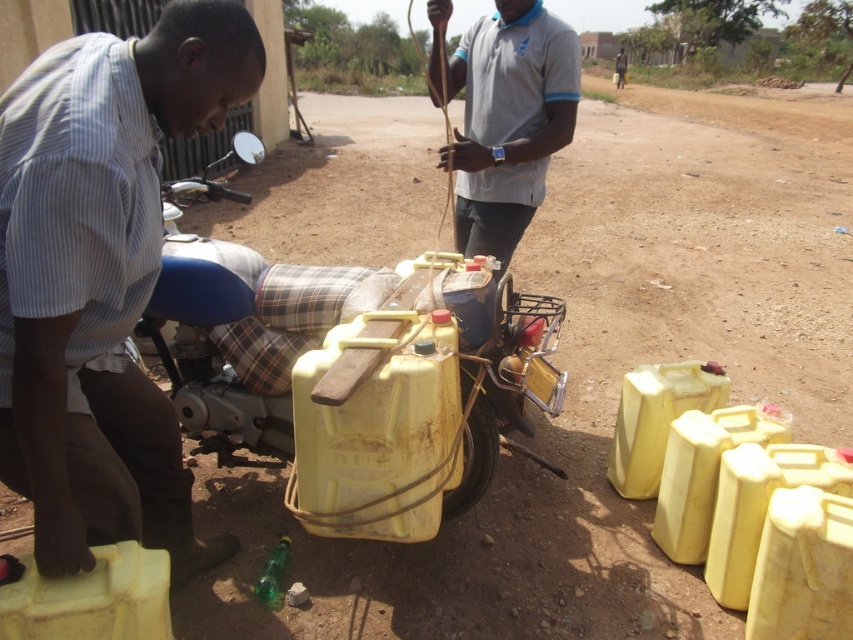
You are a photographer trying to capture a photo of the matte blue motorcycle at lower left and the gray cotton shirt at upper center. Based on their positions, which object is located to the left of the other?

The matte blue motorcycle at lower left is positioned on the left side of gray cotton shirt at upper center.